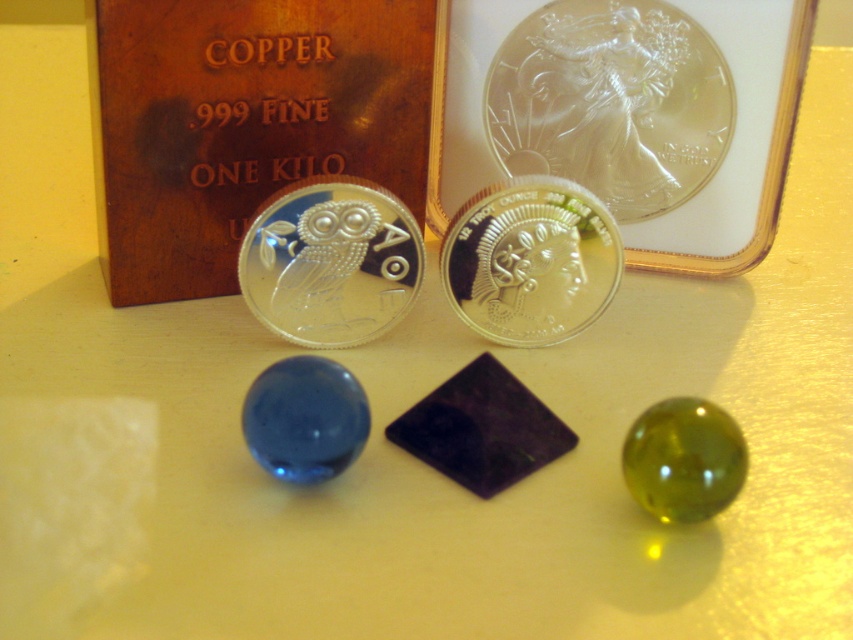
Question: Which object is the farthest from the silver/glossy coin at center?

Choices:
 (A) clear glass coin at upper center
 (B) satin silver coin at center

Answer: (A)

Question: Can you confirm if clear glass coin at upper center is positioned above silver/glossy coin at center?

Choices:
 (A) yes
 (B) no

Answer: (A)

Question: Can you confirm if clear glass coin at upper center is positioned below satin silver coin at center?

Choices:
 (A) no
 (B) yes

Answer: (A)

Question: Is clear glass coin at upper center above satin silver coin at center?

Choices:
 (A) yes
 (B) no

Answer: (A)

Question: Which object is farther from the camera taking this photo?

Choices:
 (A) satin silver coin at center
 (B) clear glass coin at upper center

Answer: (B)

Question: Among these points, which one is farthest from the camera?

Choices:
 (A) (572, 6)
 (B) (577, 240)

Answer: (A)